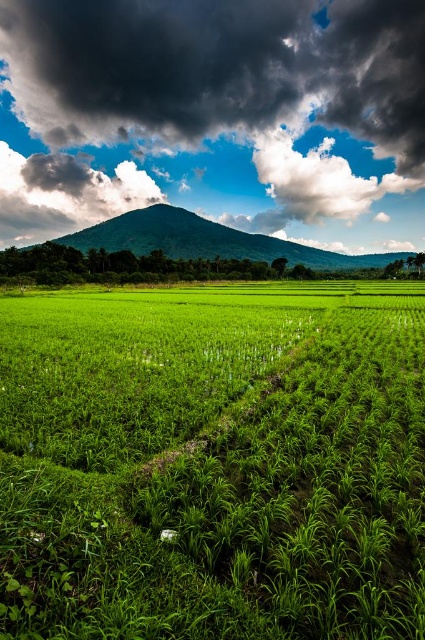
Question: Which object is closer to the camera taking this photo?

Choices:
 (A) white fluffy cloud at upper center
 (B) dark gray cloud at upper center
 (C) green grassy rice field at center

Answer: (C)

Question: Which point is closer to the camera?

Choices:
 (A) green grassy rice field at center
 (B) dark gray cloud at upper center
 (C) white fluffy cloud at upper center
 (D) green leafy mountain at center

Answer: (A)

Question: Can you confirm if green grassy rice field at center is positioned below green leafy mountain at center?

Choices:
 (A) no
 (B) yes

Answer: (B)

Question: Can you confirm if dark gray cloud at upper center is wider than green leafy mountain at center?

Choices:
 (A) yes
 (B) no

Answer: (A)

Question: Which of the following is the closest to the observer?

Choices:
 (A) (271, 620)
 (B) (291, 189)

Answer: (A)

Question: Is green grassy rice field at center further to camera compared to green leafy mountain at center?

Choices:
 (A) no
 (B) yes

Answer: (A)